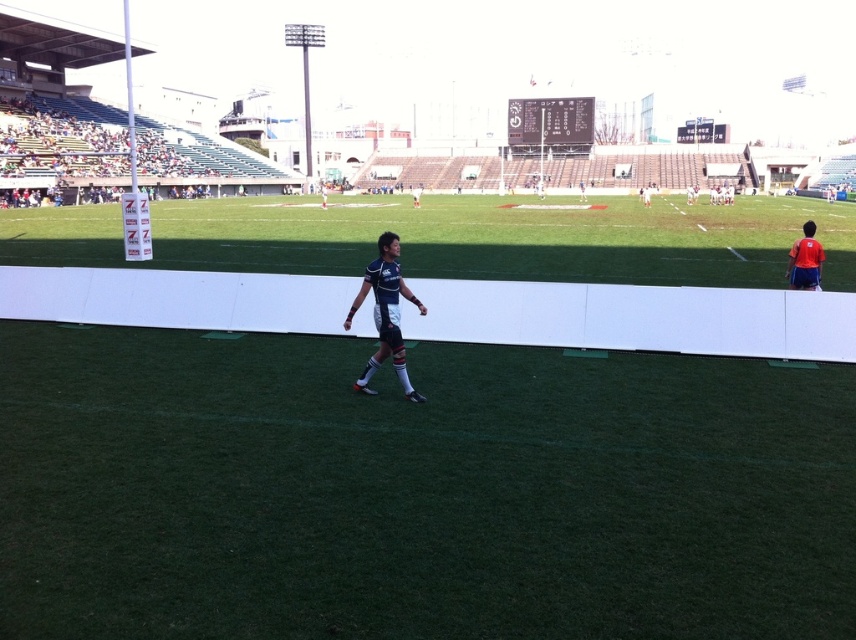
Question: Which object is closer to the camera taking this photo?

Choices:
 (A) blue jersey at center
 (B) red fabric shirt at right

Answer: (A)

Question: Can you confirm if blue jersey at center is wider than red fabric shirt at right?

Choices:
 (A) yes
 (B) no

Answer: (A)

Question: Is blue jersey at center wider than red fabric shirt at right?

Choices:
 (A) yes
 (B) no

Answer: (A)

Question: Among these objects, which one is nearest to the camera?

Choices:
 (A) red fabric shirt at right
 (B) blue jersey at center

Answer: (B)

Question: Can you confirm if blue jersey at center is positioned to the left of red fabric shirt at right?

Choices:
 (A) no
 (B) yes

Answer: (B)